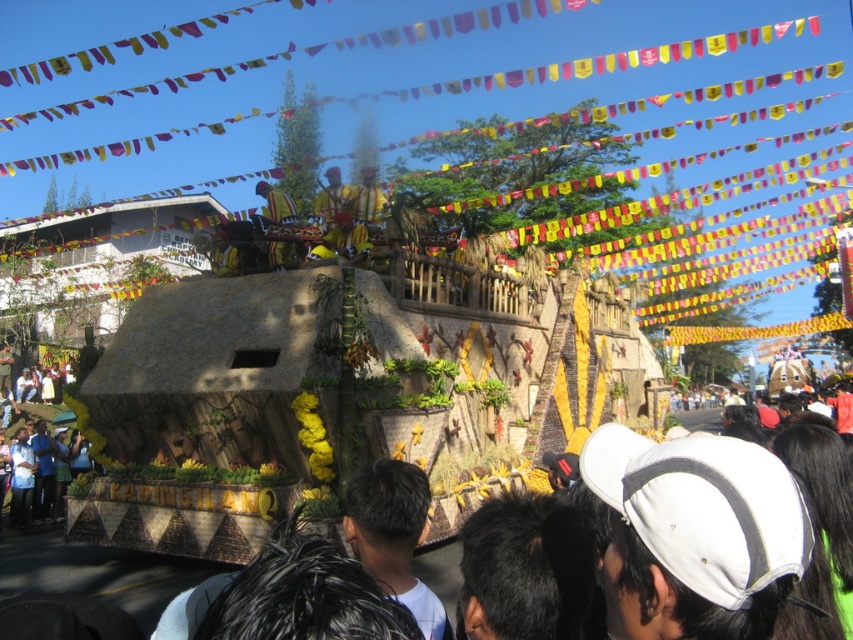
Consider the image. Can you confirm if black hair at center is positioned to the right of wooden figure at center?

Correct, you'll find black hair at center to the right of wooden figure at center.

In order to click on black hair at center in this screenshot , I will do pyautogui.click(x=393, y=534).

Is point (387, 586) positioned before point (277, 212)?

Yes, point (387, 586) is closer to viewer.

Where is `black hair at center`? black hair at center is located at coordinates (393, 534).